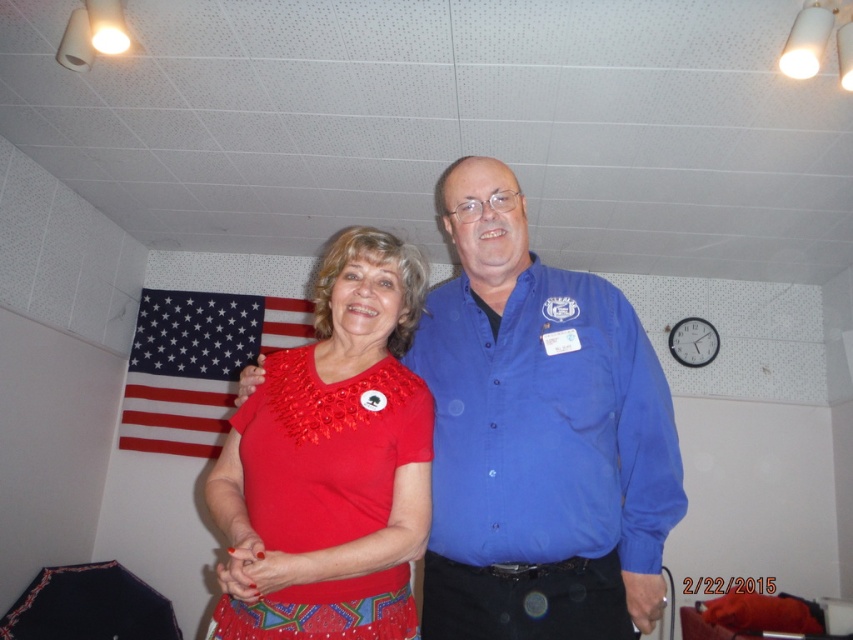
Is matte red blouse at center to the right of red fabric flag at upper left from the viewer's perspective?

Indeed, matte red blouse at center is positioned on the right side of red fabric flag at upper left.

Measure the distance between point (x=389, y=310) and camera.

A distance of 4.05 feet exists between point (x=389, y=310) and camera.

At what (x,y) coordinates should I click in order to perform the action: click on matte red blouse at center. Please return your answer as a coordinate pair (x, y). This screenshot has height=640, width=853. Looking at the image, I should click on (331, 461).

Can you confirm if blue button-up shirt at center is shorter than red fabric flag at upper left?

Indeed, blue button-up shirt at center has a lesser height compared to red fabric flag at upper left.

Is blue button-up shirt at center positioned at the back of red fabric flag at upper left?

That is False.

Who is more distant from viewer, (627, 513) or (149, 426)?

The point (149, 426) is more distant.

Locate an element on the screen. The width and height of the screenshot is (853, 640). blue button-up shirt at center is located at coordinates (547, 424).

Can you confirm if matte red blouse at center is positioned below blue button-up shirt at center?

Yes.

Does point (338, 496) come behind point (434, 356)?

No, (338, 496) is in front of (434, 356).

Is point (234, 582) farther from viewer compared to point (479, 435)?

No, it is in front of (479, 435).

You are a GUI agent. You are given a task and a screenshot of the screen. Output one action in this format:
    pyautogui.click(x=<x>, y=<y>)
    Task: Click on the matte red blouse at center
    The width and height of the screenshot is (853, 640).
    Given the screenshot: What is the action you would take?
    pyautogui.click(x=331, y=461)